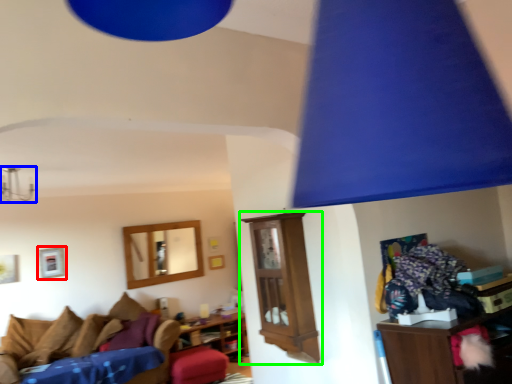
Question: Which object is the closest to the picture frame (highlighted by a red box)? Choose among these: lamp (highlighted by a blue box) or shelf (highlighted by a green box).

Choices:
 (A) lamp
 (B) shelf

Answer: (A)